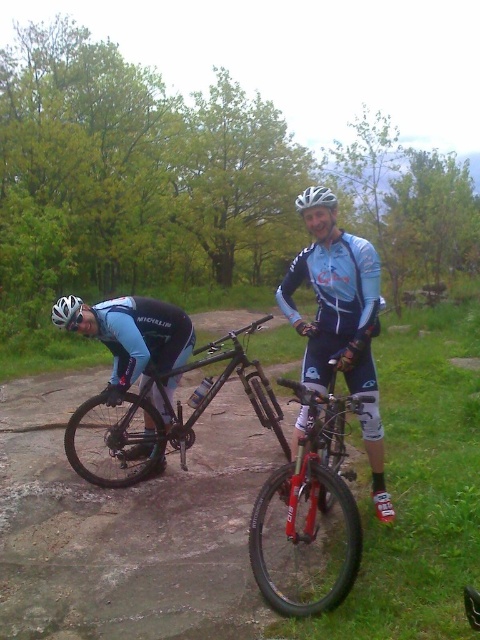
Does white matte bicycle helmet at left have a lesser height compared to white matte bicycle helmet at upper center?

Indeed, white matte bicycle helmet at left has a lesser height compared to white matte bicycle helmet at upper center.

Is point (73, 305) positioned in front of point (316, 196)?

No.

This screenshot has height=640, width=480. Identify the location of white matte bicycle helmet at left. (67, 312).

Who is more distant from viewer, (x=330, y=218) or (x=75, y=301)?

Point (x=75, y=301)

Can you confirm if white matte helmet at center is shorter than white matte bicycle helmet at left?

No.

At what (x,y) coordinates should I click in order to perform the action: click on white matte helmet at center. Please return your answer as a coordinate pair (x, y). Looking at the image, I should click on tap(319, 212).

From the picture: Who is more forward, (x=292, y=284) or (x=333, y=209)?

Point (x=333, y=209)

Who is taller, light blue jersey at center or white matte bicycle helmet at upper center?

With more height is white matte bicycle helmet at upper center.

Is point (321, 250) positioned in front of point (334, 193)?

Yes, point (321, 250) is in front of point (334, 193).

At what (x,y) coordinates should I click in order to perform the action: click on light blue jersey at center. Please return your answer as a coordinate pair (x, y). The height and width of the screenshot is (640, 480). Looking at the image, I should click on (340, 324).